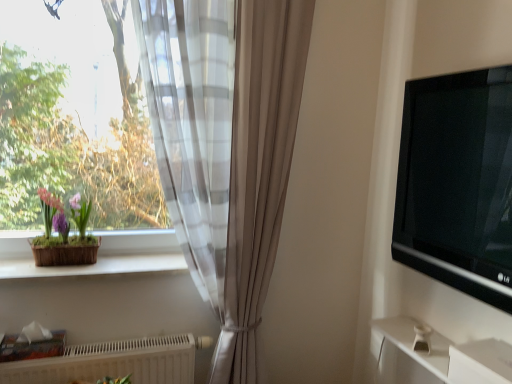
Question: Considering the positions of matte brown pot at left and black glossy tv at right in the image, is matte brown pot at left wider or thinner than black glossy tv at right?

Choices:
 (A) thin
 (B) wide

Answer: (B)

Question: In the image, is matte brown pot at left on the left side or the right side of black glossy tv at right?

Choices:
 (A) right
 (B) left

Answer: (B)

Question: Estimate the real-world distances between objects in this image. Which object is farther from the white smooth window sill at lower left?

Choices:
 (A) translucent glass window at left
 (B) sheer white curtain at left
 (C) black glossy tv at right
 (D) white plastic drawer at lower right
 (E) white textured radiator at lower left

Answer: (D)

Question: Based on their relative distances, which object is nearer to the white plastic drawer at lower right?

Choices:
 (A) black glossy tv at right
 (B) matte brown pot at left
 (C) white textured radiator at lower left
 (D) translucent glass window at left
 (E) sheer white curtain at left

Answer: (A)